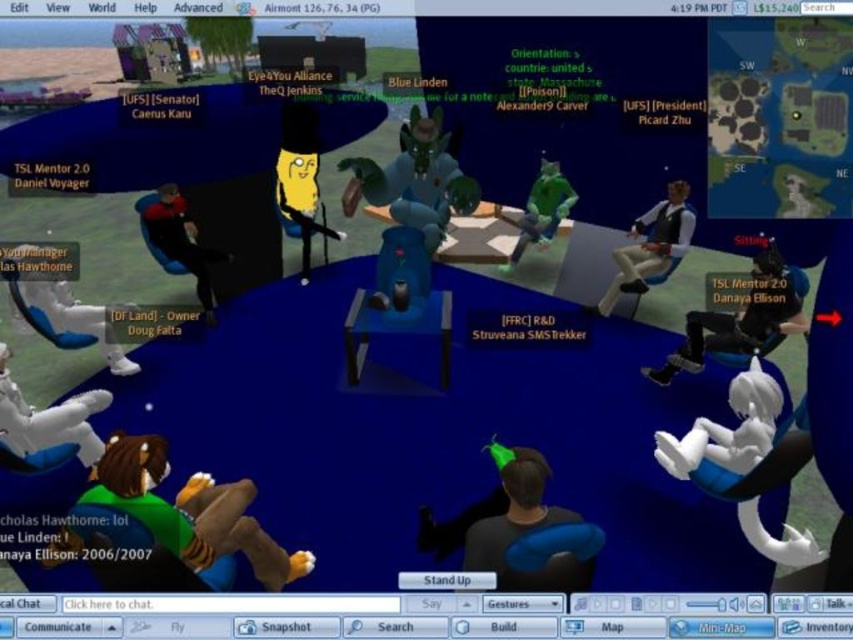
Question: Does black matte hair at center have a lesser width compared to white plush toy at right?

Choices:
 (A) yes
 (B) no

Answer: (A)

Question: Does black matte hair at center appear over green rubber alien at center?

Choices:
 (A) no
 (B) yes

Answer: (A)

Question: Can you confirm if white plush toy at lower left is thinner than white fabric shirt at right?

Choices:
 (A) yes
 (B) no

Answer: (A)

Question: Which point is farther to the camera?

Choices:
 (A) (514, 529)
 (B) (693, 332)

Answer: (B)

Question: Which point is closer to the camera?

Choices:
 (A) green rubber alien at center
 (B) white plush toy at right

Answer: (B)

Question: Among these points, which one is farthest from the camera?

Choices:
 (A) (523, 218)
 (B) (614, 253)

Answer: (A)